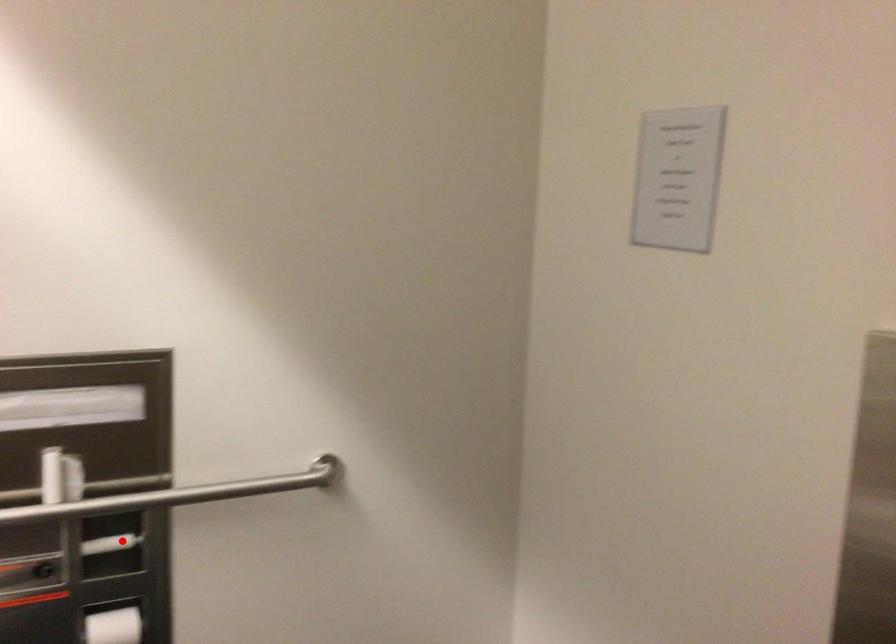
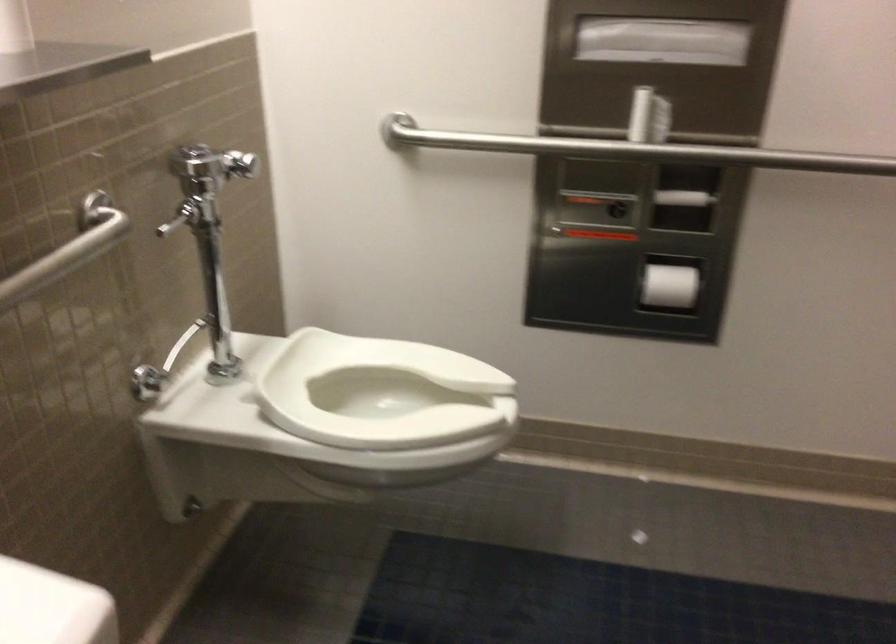
Locate, in the second image, the point that corresponds to the highlighted location in the first image.

(683, 198)